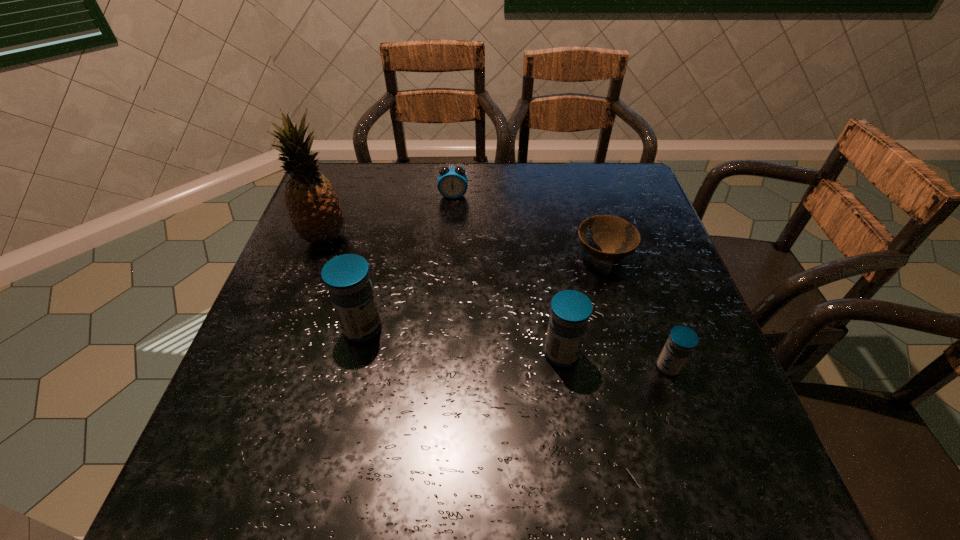
Locate an element on the screen. This screenshot has width=960, height=540. free space that is in between the rightmost medicine and the shortest object is located at coordinates (636, 312).

Where is `vacant space in between the farthest object and the leftmost medicine`? This screenshot has width=960, height=540. vacant space in between the farthest object and the leftmost medicine is located at coordinates (408, 262).

Where is `empty location between the shortest object and the shortest medicine`? empty location between the shortest object and the shortest medicine is located at coordinates (636, 312).

What are the coordinates of `vacant space in between the rightmost medicine and the shortest object` in the screenshot? It's located at (636, 312).

The height and width of the screenshot is (540, 960). In order to click on the second closest object to the pineapple in this screenshot , I will do `click(452, 183)`.

Where is `object that stands as the fifth closest to the rightmost medicine`? The width and height of the screenshot is (960, 540). object that stands as the fifth closest to the rightmost medicine is located at coordinates (313, 206).

Where is `medicine that is the third nearest to the shortest object`? medicine that is the third nearest to the shortest object is located at coordinates (347, 277).

You are a GUI agent. You are given a task and a screenshot of the screen. Output one action in this format:
    pyautogui.click(x=<x>, y=<y>)
    Task: Click on the medicine that can be found as the second closest to the shortest medicine
    The width and height of the screenshot is (960, 540).
    Given the screenshot: What is the action you would take?
    pyautogui.click(x=347, y=277)

Identify the location of free point that satisfies the following two spatial constraints: 1. on the front side of the leftmost object; 2. on the left side of the second object from left to right. (290, 328).

At what (x,y) coordinates should I click in order to perform the action: click on vacant point that satisfies the following two spatial constraints: 1. on the front side of the second object from left to right; 2. on the right side of the second shortest medicine. Please return your answer as a coordinate pair (x, y). Image resolution: width=960 pixels, height=540 pixels. Looking at the image, I should click on (357, 354).